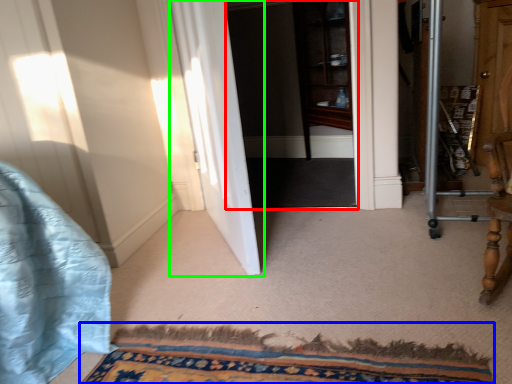
Question: Based on their relative distances, which object is nearer to screen door (highlighted by a red box)? Choose from doormat (highlighted by a blue box) and door (highlighted by a green box).

Choices:
 (A) doormat
 (B) door

Answer: (B)